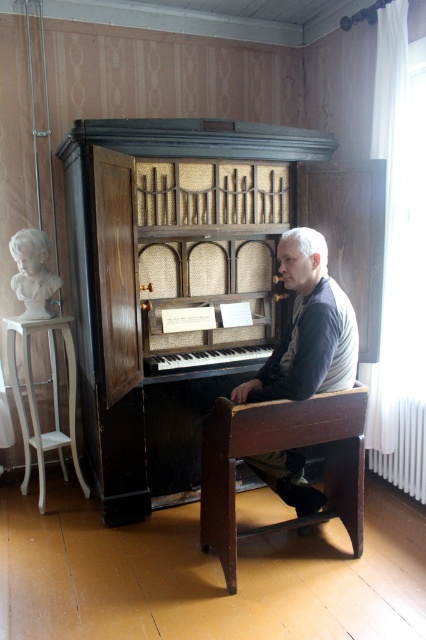
Question: Which object is closer to the camera taking this photo?

Choices:
 (A) brown wooden chair at lower center
 (B) matte white bust at left
 (C) black polished wood piano at center

Answer: (A)

Question: Is brown wooden chair at lower center positioned at the back of white wood stool at left?

Choices:
 (A) no
 (B) yes

Answer: (A)

Question: Does dark gray sweater at center appear on the left side of matte white bust at left?

Choices:
 (A) no
 (B) yes

Answer: (A)

Question: Does white wood stool at left lie behind matte white bust at left?

Choices:
 (A) no
 (B) yes

Answer: (B)

Question: Considering the real-world distances, which object is closest to the white wood stool at left?

Choices:
 (A) black polished wood piano at center
 (B) dark gray sweater at center
 (C) matte white bust at left
 (D) brown wooden chair at lower center

Answer: (C)

Question: Which object appears closest to the camera in this image?

Choices:
 (A) matte white bust at left
 (B) black polished wood piano at center

Answer: (A)